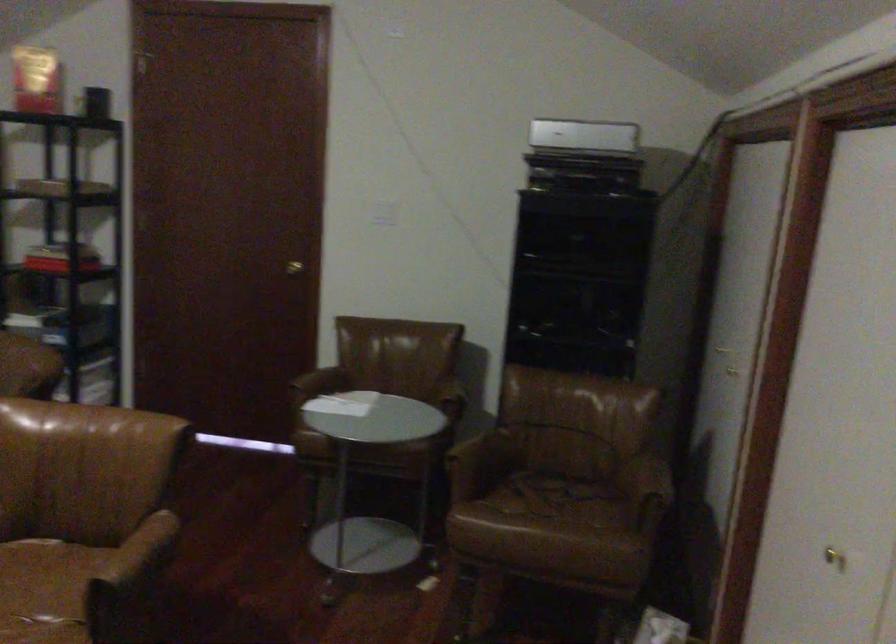
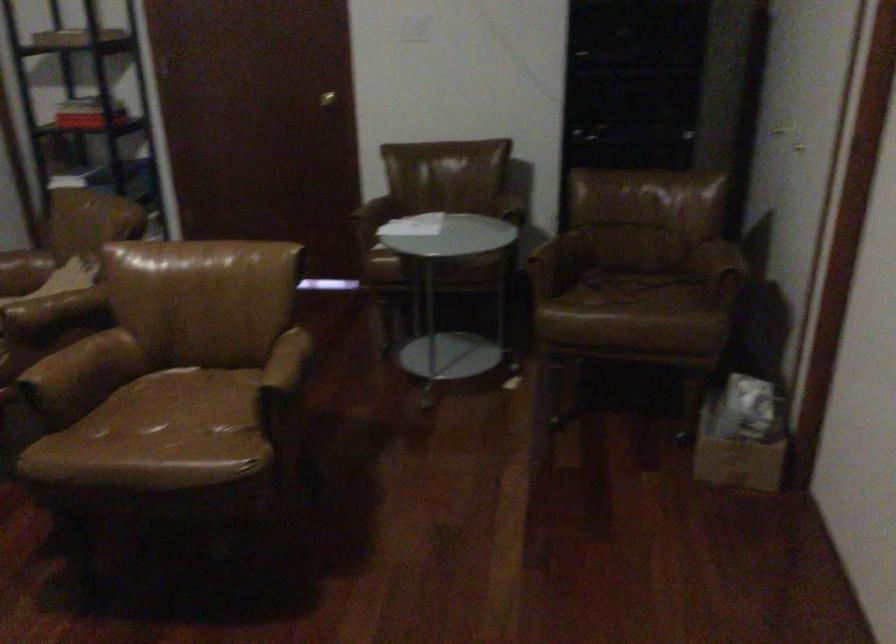
In the second image, find the point that corresponds to [294,267] in the first image.

(326, 99)